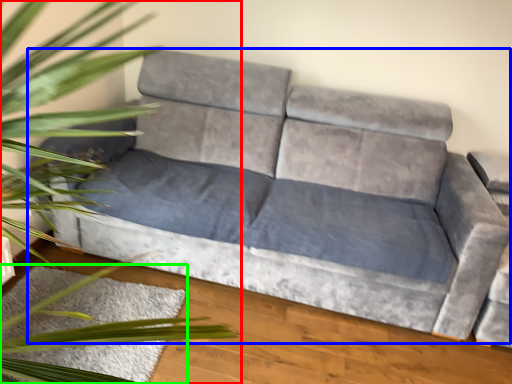
Question: Estimate the real-world distances between objects in this image. Which object is closer to houseplant (highlighted by a red box), studio couch (highlighted by a blue box) or mat (highlighted by a green box)?

Choices:
 (A) studio couch
 (B) mat

Answer: (B)